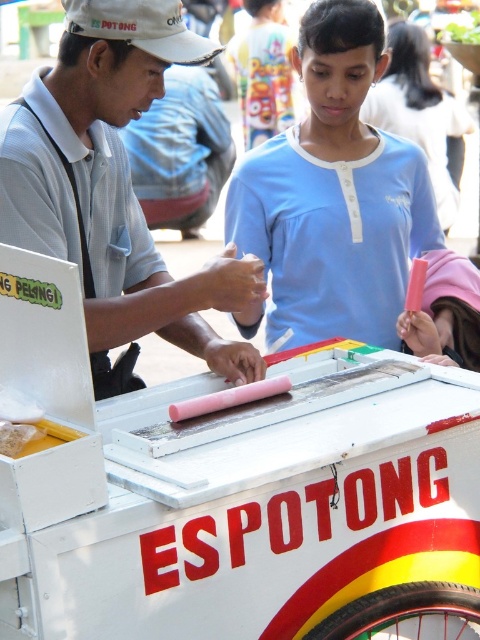
You are a customer at the es potong stall. You notice the matte pink ice cream at center and the white matte baseball cap at upper left. Which object is taller?

The matte pink ice cream at center is taller than the white matte baseball cap at upper left according to the description.

You are a customer at the es potong stall. You see the pink matte ice cream at center and the white matte baseball cap at upper left. Which object is located higher in the image?

The white matte baseball cap at upper left is located higher than the pink matte ice cream at center in the image.